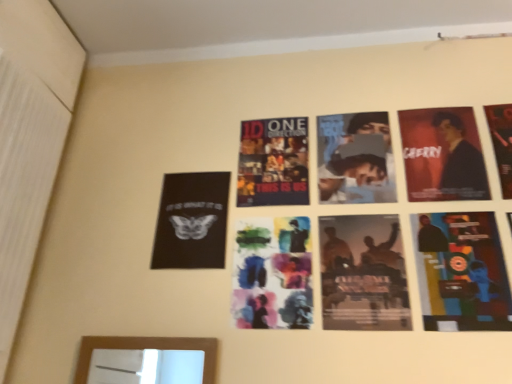
Find the location of a particular element. The height and width of the screenshot is (384, 512). watercolor paper poster at center, placed as the second poster when sorted from left to right is located at coordinates (272, 274).

Measure the distance between matte black suit at upper right and camera.

The distance of matte black suit at upper right from camera is 3.70 feet.

What do you see at coordinates (502, 143) in the screenshot?
I see `matte black poster at upper right, the 1th poster from the right` at bounding box center [502, 143].

Describe the element at coordinates (192, 221) in the screenshot. This screenshot has width=512, height=384. I see `black matte poster at upper left, the 5th poster viewed from the right` at that location.

This screenshot has width=512, height=384. What do you see at coordinates (462, 272) in the screenshot?
I see `multicolored paper collage at lower right, placed as the 2th poster when sorted from right to left` at bounding box center [462, 272].

This screenshot has height=384, width=512. What are the coordinates of `silhouette paper poster at center, which is the 3th poster in left-to-right order` in the screenshot? It's located at (362, 274).

Locate an element on the screen. Image resolution: width=512 pixels, height=384 pixels. poster located in front of the silhouette paper poster at center, arranged as the third poster when viewed from the right is located at coordinates (462, 272).

Between multicolored paper collage at lower right, the fourth poster in the left-to-right sequence, and silhouette paper poster at center, which is the 3th poster in left-to-right order, which one is positioned behind?

silhouette paper poster at center, which is the 3th poster in left-to-right order, is more distant.

Choose the correct answer: Is multicolored paper collage at lower right, placed as the 2th poster when sorted from right to left, inside silhouette paper poster at center, which is the 3th poster in left-to-right order, or outside it?

The correct answer is: outside.

Which is in front, point (433, 250) or point (345, 225)?

The point (433, 250) is closer to the camera.

Considering the relative sizes of matte black suit at upper right and watercolor paper poster at center, placed as the second poster when sorted from left to right, in the image provided, is matte black suit at upper right smaller than watercolor paper poster at center, placed as the second poster when sorted from left to right,?

Yes, matte black suit at upper right is smaller than watercolor paper poster at center, placed as the second poster when sorted from left to right.

In the scene shown: Is matte black suit at upper right positioned far away from watercolor paper poster at center, placed as the second poster when sorted from left to right?

No, matte black suit at upper right is not far away from watercolor paper poster at center, placed as the second poster when sorted from left to right.

From a real-world perspective, is matte black suit at upper right under watercolor paper poster at center, placed as the second poster when sorted from left to right?

Actually, matte black suit at upper right is physically above watercolor paper poster at center, placed as the second poster when sorted from left to right, in the real world.

From the image's perspective, which one is positioned lower, matte black suit at upper right or watercolor paper poster at center, placed as the second poster when sorted from left to right?

watercolor paper poster at center, placed as the second poster when sorted from left to right, is shown below in the image.

In the scene shown: Considering the positions of objects silhouette paper poster at center, which is the 3th poster in left-to-right order, and matte black suit at upper right in the image provided, who is more to the left, silhouette paper poster at center, which is the 3th poster in left-to-right order, or matte black suit at upper right?

From the viewer's perspective, silhouette paper poster at center, which is the 3th poster in left-to-right order, appears more on the left side.

Is silhouette paper poster at center, arranged as the third poster when viewed from the right, next to matte black suit at upper right and touching it?

silhouette paper poster at center, arranged as the third poster when viewed from the right, and matte black suit at upper right are clearly separated.

From a real-world perspective, between silhouette paper poster at center, arranged as the third poster when viewed from the right, and matte black suit at upper right, who is vertically higher?

In real-world perspective, matte black suit at upper right is above.

In the image, is silhouette paper poster at center, which is the 3th poster in left-to-right order, positioned in front of or behind matte black suit at upper right?

Clearly, silhouette paper poster at center, which is the 3th poster in left-to-right order, is in front of matte black suit at upper right.

From the image's perspective, is black matte poster at upper left, the 5th poster viewed from the right, located above or below multicolored paper collage at lower right, placed as the 2th poster when sorted from right to left?

black matte poster at upper left, the 5th poster viewed from the right, is above multicolored paper collage at lower right, placed as the 2th poster when sorted from right to left.

Are black matte poster at upper left, the 5th poster viewed from the right, and multicolored paper collage at lower right, placed as the 2th poster when sorted from right to left, far apart?

That's not correct — black matte poster at upper left, the 5th poster viewed from the right, is a little close to multicolored paper collage at lower right, placed as the 2th poster when sorted from right to left.

Between black matte poster at upper left, the 5th poster viewed from the right, and multicolored paper collage at lower right, the fourth poster in the left-to-right sequence, which one has larger size?

multicolored paper collage at lower right, the fourth poster in the left-to-right sequence, is bigger.

Can we say black matte poster at upper left, the 5th poster viewed from the right, lies outside multicolored paper collage at lower right, the fourth poster in the left-to-right sequence?

Yes.

In the scene shown: Is watercolor paper poster at center, placed as the second poster when sorted from left to right, in front of or behind matte black poster at upper right, the 5th poster when ordered from left to right, in the image?

watercolor paper poster at center, placed as the second poster when sorted from left to right, is positioned closer to the viewer than matte black poster at upper right, the 5th poster when ordered from left to right.

Which is nearer, (291, 326) or (508, 149)?

Point (291, 326)

Which of these two, watercolor paper poster at center, placed as the second poster when sorted from left to right, or matte black poster at upper right, the 1th poster from the right, stands taller?

Standing taller between the two is matte black poster at upper right, the 1th poster from the right.

Is watercolor paper poster at center, which appears as the fourth poster when viewed from the right, smaller than matte black poster at upper right, the 1th poster from the right?

Actually, watercolor paper poster at center, which appears as the fourth poster when viewed from the right, might be larger than matte black poster at upper right, the 1th poster from the right.

From the picture: Would you say multicolored paper collage at lower right, placed as the 2th poster when sorted from right to left, is inside or outside matte black poster at upper right, the 5th poster when ordered from left to right?

multicolored paper collage at lower right, placed as the 2th poster when sorted from right to left, is spatially situated outside matte black poster at upper right, the 5th poster when ordered from left to right.

Is multicolored paper collage at lower right, the fourth poster in the left-to-right sequence, looking in the opposite direction of matte black poster at upper right, the 1th poster from the right?

No, multicolored paper collage at lower right, the fourth poster in the left-to-right sequence, is not facing away from matte black poster at upper right, the 1th poster from the right.

Based on the photo, is multicolored paper collage at lower right, placed as the 2th poster when sorted from right to left, in contact with matte black poster at upper right, the 1th poster from the right?

multicolored paper collage at lower right, placed as the 2th poster when sorted from right to left, is not next to matte black poster at upper right, the 1th poster from the right, and they're not touching.

Can you confirm if multicolored paper collage at lower right, the fourth poster in the left-to-right sequence, is shorter than matte black poster at upper right, the 5th poster when ordered from left to right?

No.

Considering their positions, is multicolored paper collage at lower right, placed as the 2th poster when sorted from right to left, located in front of or behind watercolor paper poster at center, placed as the second poster when sorted from left to right?

multicolored paper collage at lower right, placed as the 2th poster when sorted from right to left, is in front of watercolor paper poster at center, placed as the second poster when sorted from left to right.

From the picture: Is multicolored paper collage at lower right, the fourth poster in the left-to-right sequence, at the left side of watercolor paper poster at center, which appears as the fourth poster when viewed from the right?

In fact, multicolored paper collage at lower right, the fourth poster in the left-to-right sequence, is to the right of watercolor paper poster at center, which appears as the fourth poster when viewed from the right.

Who is smaller, multicolored paper collage at lower right, the fourth poster in the left-to-right sequence, or watercolor paper poster at center, which appears as the fourth poster when viewed from the right?

Smaller between the two is multicolored paper collage at lower right, the fourth poster in the left-to-right sequence.

At what (x,y) coordinates should I click in order to perform the action: click on the 1st poster above when counting from the silhouette paper poster at center, which is the 3th poster in left-to-right order (from the image's perspective). Please return your answer as a coordinate pair (x, y). Looking at the image, I should click on (462, 272).

Where is `poster that is the 3rd one when counting leftward from the matte black suit at upper right`? Image resolution: width=512 pixels, height=384 pixels. poster that is the 3rd one when counting leftward from the matte black suit at upper right is located at coordinates (272, 274).

From the image, which object appears to be nearer to matte black suit at upper right, watercolor paper poster at center, placed as the second poster when sorted from left to right, or silhouette paper poster at center, which is the 3th poster in left-to-right order?

silhouette paper poster at center, which is the 3th poster in left-to-right order, lies closer to matte black suit at upper right than the other object.

Considering their positions, is multicolored paper collage at lower right, placed as the 2th poster when sorted from right to left, positioned closer to matte black suit at upper right than watercolor paper poster at center, placed as the second poster when sorted from left to right?

multicolored paper collage at lower right, placed as the 2th poster when sorted from right to left.

Considering their positions, is black matte poster at upper left, the 5th poster viewed from the right, positioned closer to watercolor paper poster at center, placed as the second poster when sorted from left to right, than matte black suit at upper right?

Among the two, black matte poster at upper left, the 5th poster viewed from the right, is located nearer to watercolor paper poster at center, placed as the second poster when sorted from left to right.

Which object lies nearer to the anchor point silhouette paper poster at center, arranged as the third poster when viewed from the right, matte black poster at upper right, the 1th poster from the right, or black matte poster at upper left, arranged as the first poster when viewed from the left?

The object closer to silhouette paper poster at center, arranged as the third poster when viewed from the right, is black matte poster at upper left, arranged as the first poster when viewed from the left.

From the image, which object appears to be farther from matte black poster at upper right, the 1th poster from the right, multicolored paper collage at lower right, placed as the 2th poster when sorted from right to left, or matte black suit at upper right?

The object further to matte black poster at upper right, the 1th poster from the right, is multicolored paper collage at lower right, placed as the 2th poster when sorted from right to left.

Estimate the real-world distances between objects in this image. Which object is closer to watercolor paper poster at center, placed as the second poster when sorted from left to right, multicolored paper collage at lower right, placed as the 2th poster when sorted from right to left, or black matte poster at upper left, the 5th poster viewed from the right?

black matte poster at upper left, the 5th poster viewed from the right.

Looking at the image, which one is located closer to black matte poster at upper left, the 5th poster viewed from the right, watercolor paper poster at center, which appears as the fourth poster when viewed from the right, or multicolored paper collage at lower right, placed as the 2th poster when sorted from right to left?

Among the two, watercolor paper poster at center, which appears as the fourth poster when viewed from the right, is located nearer to black matte poster at upper left, the 5th poster viewed from the right.

Based on their spatial positions, is black matte poster at upper left, the 5th poster viewed from the right, or watercolor paper poster at center, which appears as the fourth poster when viewed from the right, closer to silhouette paper poster at center, which is the 3th poster in left-to-right order?

Among the two, watercolor paper poster at center, which appears as the fourth poster when viewed from the right, is located nearer to silhouette paper poster at center, which is the 3th poster in left-to-right order.

You are a GUI agent. You are given a task and a screenshot of the screen. Output one action in this format:
    pyautogui.click(x=<x>, y=<y>)
    Task: Click on the poster between black matte poster at upper left, arranged as the first poster when viewed from the left, and silhouette paper poster at center, arranged as the third poster when viewed from the right, in the horizontal direction
    The image size is (512, 384).
    Given the screenshot: What is the action you would take?
    pyautogui.click(x=272, y=274)

The width and height of the screenshot is (512, 384). Identify the location of person between black matte poster at upper left, the 5th poster viewed from the right, and matte black poster at upper right, the 1th poster from the right, from left to right. (460, 156).

In order to click on person between silhouette paper poster at center, arranged as the third poster when viewed from the right, and matte black poster at upper right, the 5th poster when ordered from left to right, in the horizontal direction in this screenshot , I will do `click(460, 156)`.

Where is `poster between watercolor paper poster at center, which appears as the fourth poster when viewed from the right, and multicolored paper collage at lower right, placed as the 2th poster when sorted from right to left, from left to right`? poster between watercolor paper poster at center, which appears as the fourth poster when viewed from the right, and multicolored paper collage at lower right, placed as the 2th poster when sorted from right to left, from left to right is located at coordinates (362, 274).